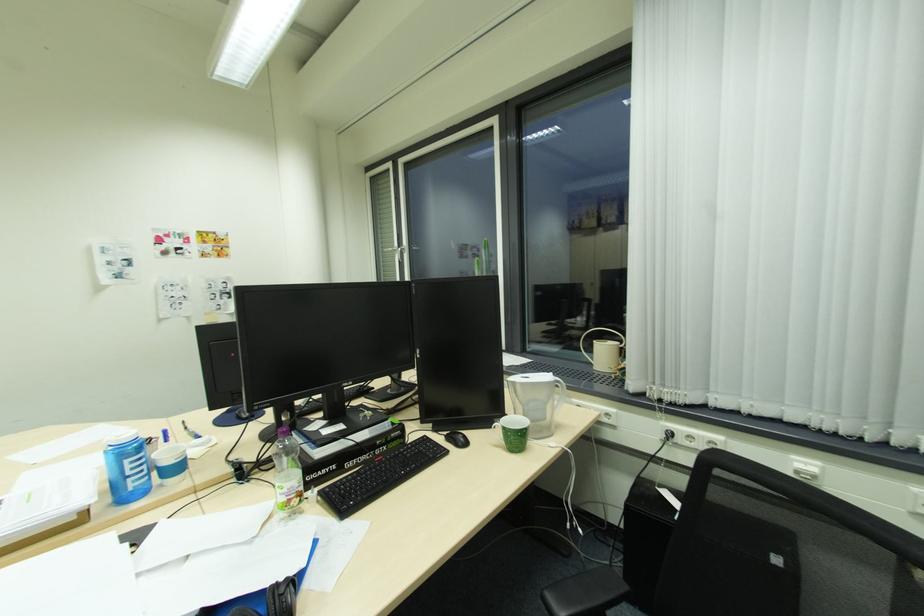
Where would you lift the beige mug handle? Please return your answer as a coordinate pair (x, y).

(603, 351)